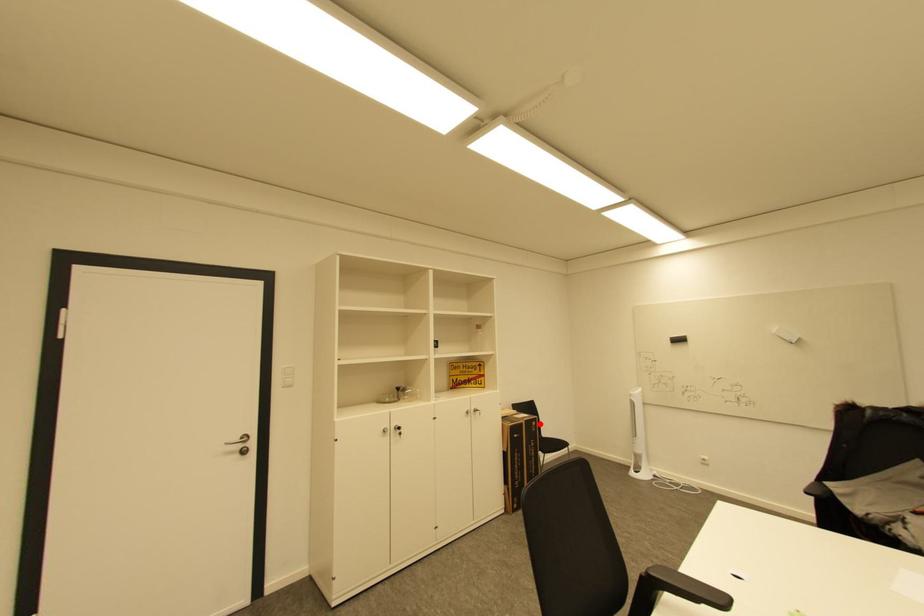
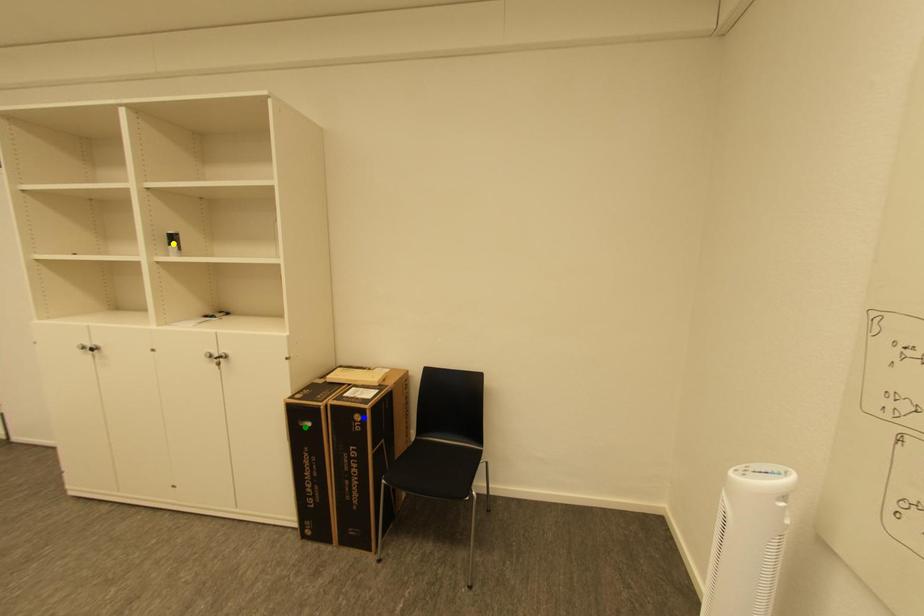
Question: I am providing you with two images of the same scene from different viewpoints. A red point is marked on the first image. You are given multiple points on the second image. Which point in image 2 represents the same 3d spot as the red point in image 1?

Choices:
 (A) yellow point
 (B) blue point
 (C) green point

Answer: (B)